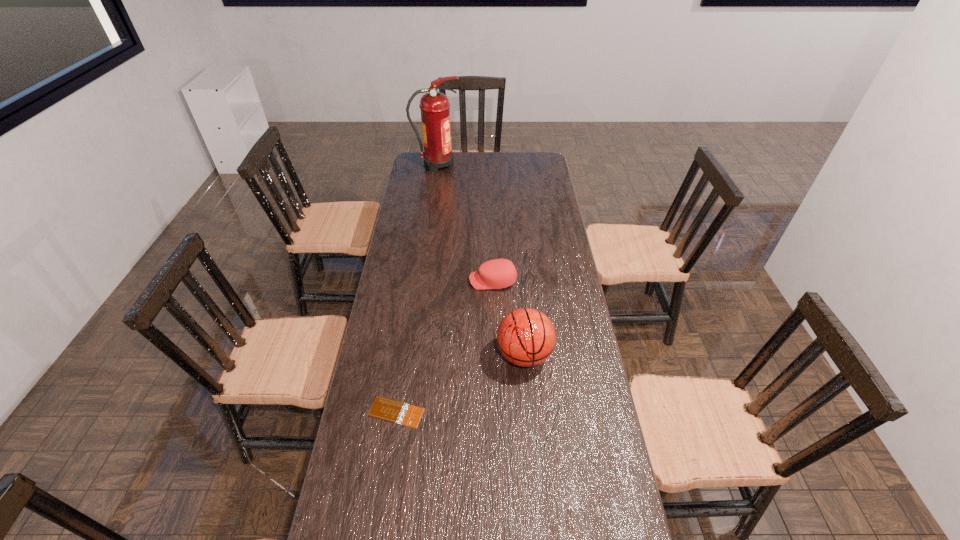
At what (x,y) coordinates should I click in order to perform the action: click on fire extinguisher. Please return your answer as a coordinate pair (x, y). Looking at the image, I should click on (x=435, y=108).

At what (x,y) coordinates should I click in order to perform the action: click on the farthest object. Please return your answer as a coordinate pair (x, y). Looking at the image, I should click on [435, 108].

Find the location of a particular element. The image size is (960, 540). the third farthest object is located at coordinates (526, 337).

The height and width of the screenshot is (540, 960). In order to click on the second tallest object in this screenshot , I will do `click(526, 337)`.

At what (x,y) coordinates should I click in order to perform the action: click on cap. Please return your answer as a coordinate pair (x, y). Looking at the image, I should click on (498, 273).

Find the location of a particular element. This screenshot has height=540, width=960. the second shortest object is located at coordinates (498, 273).

Find the location of a particular element. This screenshot has width=960, height=540. the nearest object is located at coordinates (386, 409).

Locate an element on the screen. This screenshot has height=540, width=960. chocolate bar is located at coordinates (386, 409).

Identify the location of vacant space situated 0.270m on the front-facing side of the fire extinguisher. (512, 165).

Locate an element on the screen. This screenshot has width=960, height=540. free space located 0.290m on the side with spill of the basketball is located at coordinates (535, 472).